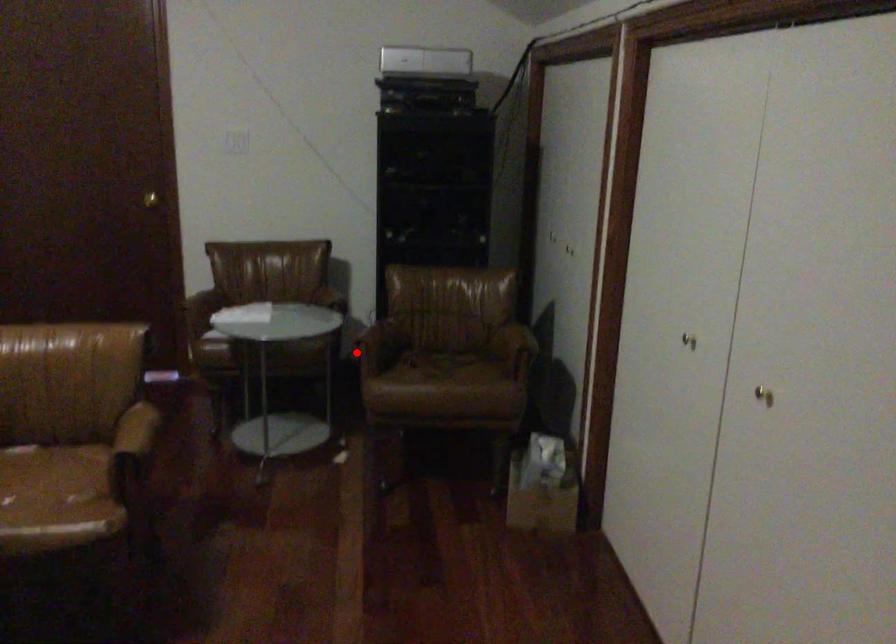
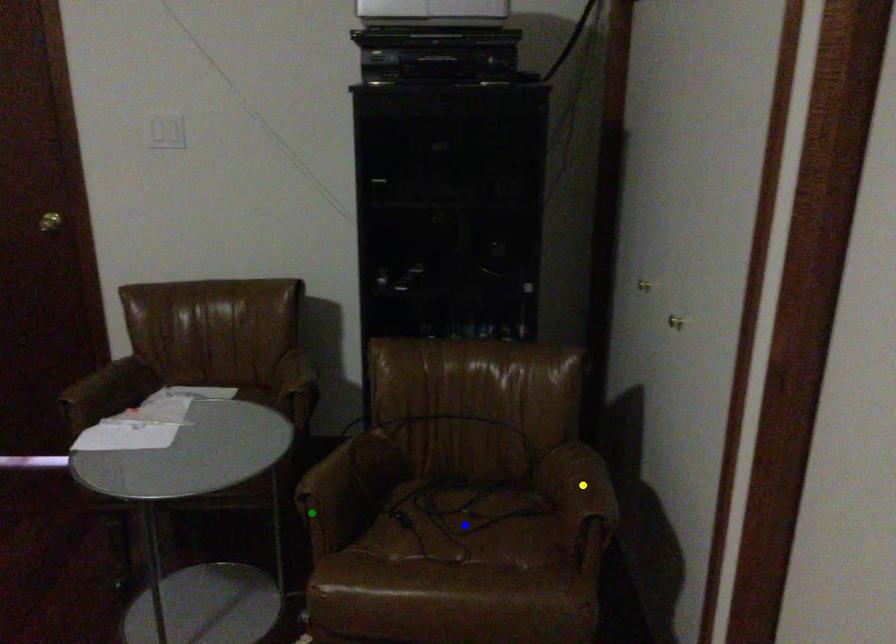
Question: I am providing you with two images of the same scene from different viewpoints. A red point is marked on the first image. You are given multiple points on the second image. Which mark in image 2 goes with the point in image 1?

Choices:
 (A) yellow point
 (B) blue point
 (C) green point

Answer: (C)